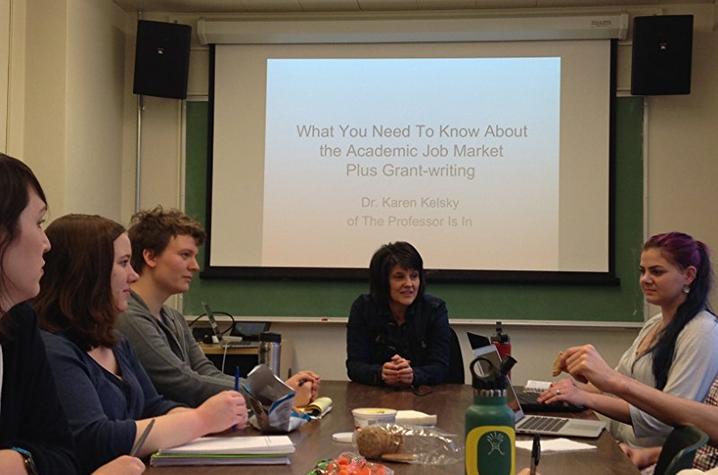
The width and height of the screenshot is (718, 475). In order to click on chalkboard in this screenshot , I will do `click(600, 298)`.